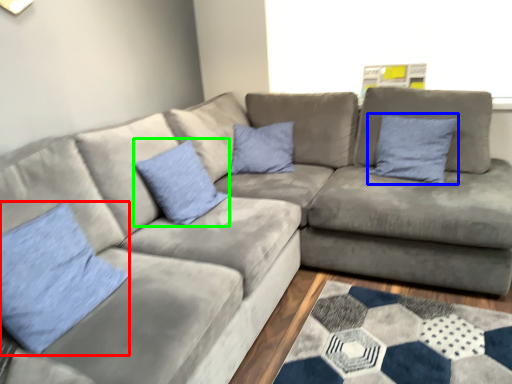
Question: Which is nearer to the pillow (highlighted by a red box)? pillow (highlighted by a blue box) or pillow (highlighted by a green box).

Choices:
 (A) pillow
 (B) pillow

Answer: (B)